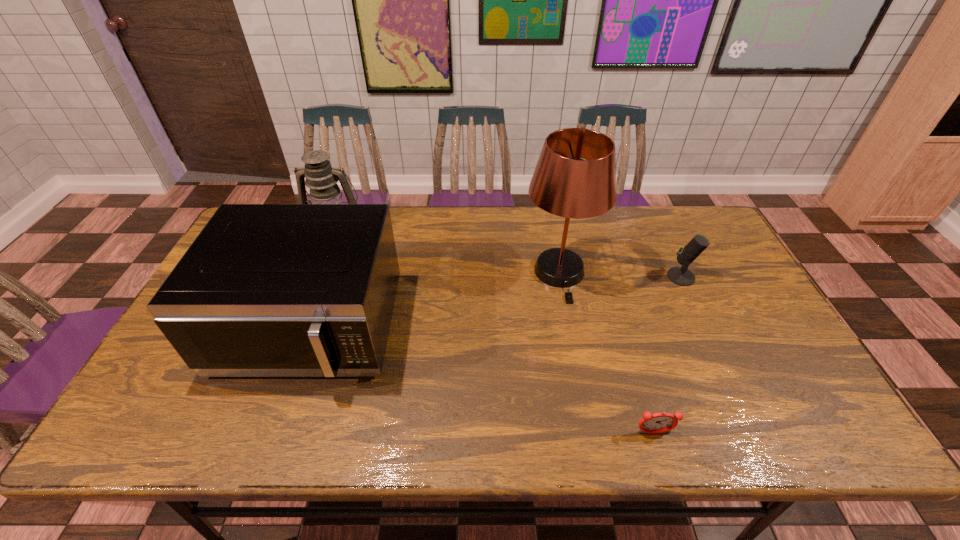
In order to click on free space between the lampshade and the rightmost object in this screenshot , I will do `click(620, 275)`.

At what (x,y) coordinates should I click in order to perform the action: click on vacant area between the tallest object and the rightmost object. Please return your answer as a coordinate pair (x, y). This screenshot has height=540, width=960. Looking at the image, I should click on (620, 275).

Where is `unoccupied position between the oil lamp and the lampshade`? unoccupied position between the oil lamp and the lampshade is located at coordinates (448, 253).

The image size is (960, 540). In order to click on vacant area that lies between the microwave_oven and the nearest object in this screenshot , I will do `click(482, 381)`.

The image size is (960, 540). In order to click on vacant space that's between the lampshade and the microwave_oven in this screenshot , I will do `click(435, 301)`.

The width and height of the screenshot is (960, 540). In order to click on vacant space in between the microwave_oven and the lampshade in this screenshot , I will do `click(435, 301)`.

Identify the location of vacant area that lies between the microwave_oven and the lampshade. This screenshot has height=540, width=960. (435, 301).

Identify the location of blank region between the nearest object and the microwave_oven. This screenshot has width=960, height=540. point(482,381).

What are the coordinates of `vacant region between the microphone and the alarm clock` in the screenshot? It's located at (667, 355).

Image resolution: width=960 pixels, height=540 pixels. What are the coordinates of `vacant area that lies between the fourth tallest object and the lampshade` in the screenshot? It's located at (620, 275).